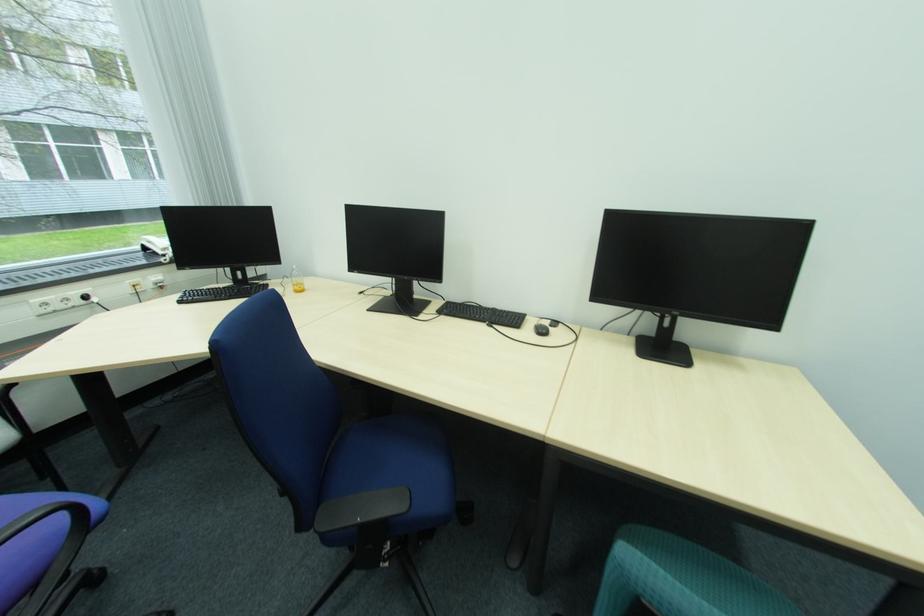
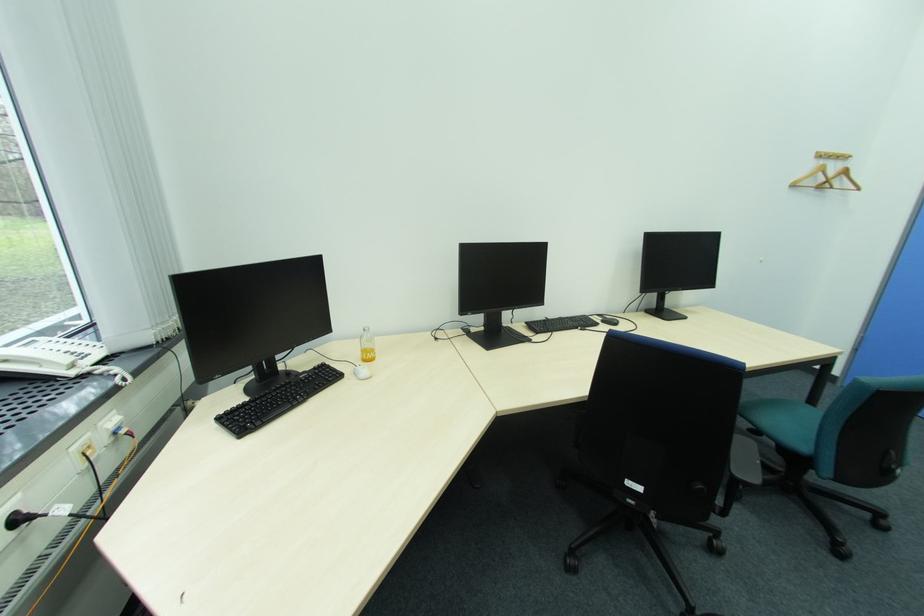
Locate, in the second image, the point that corresponds to pixel 159 243 in the first image.

(11, 362)